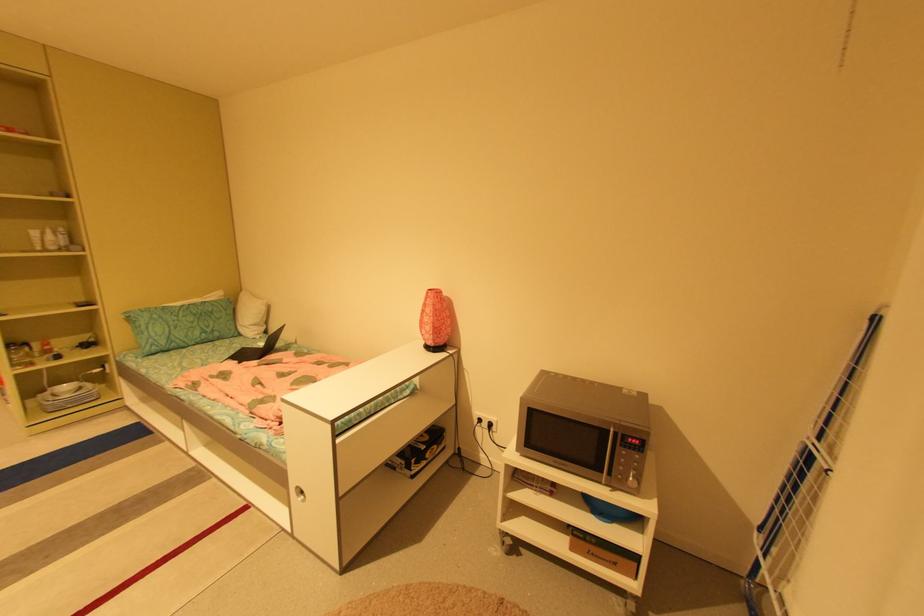
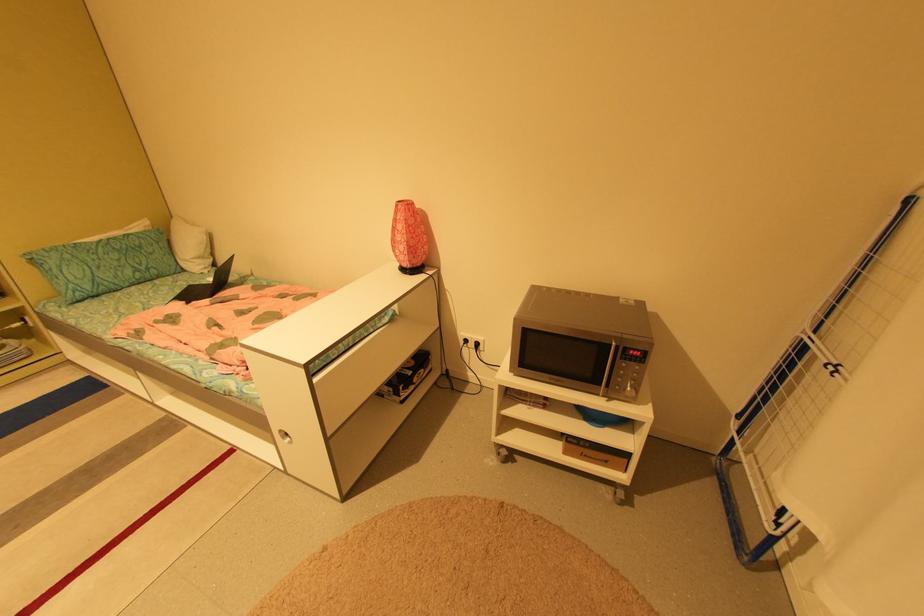
Where in the second image is the point corresponding to (x=436, y=290) from the first image?

(406, 201)